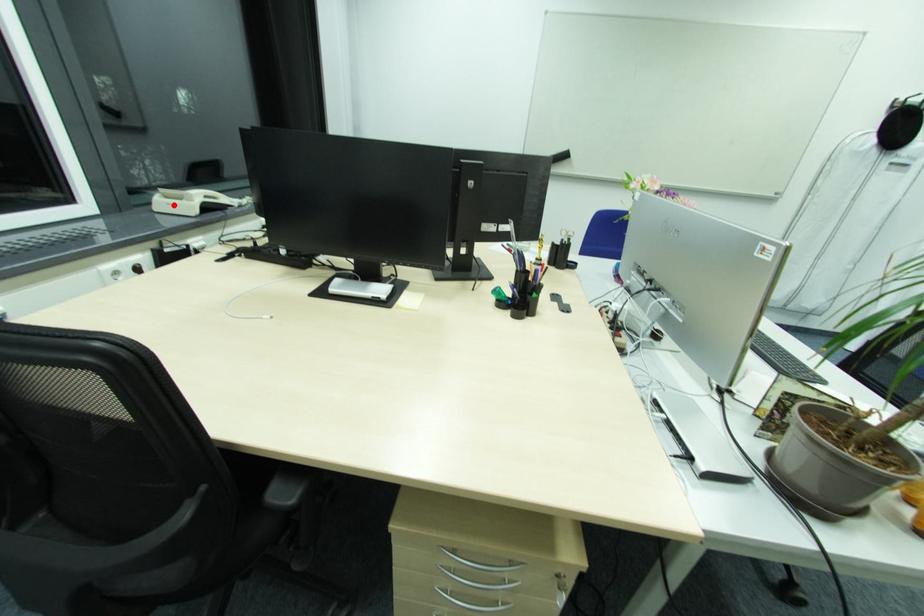
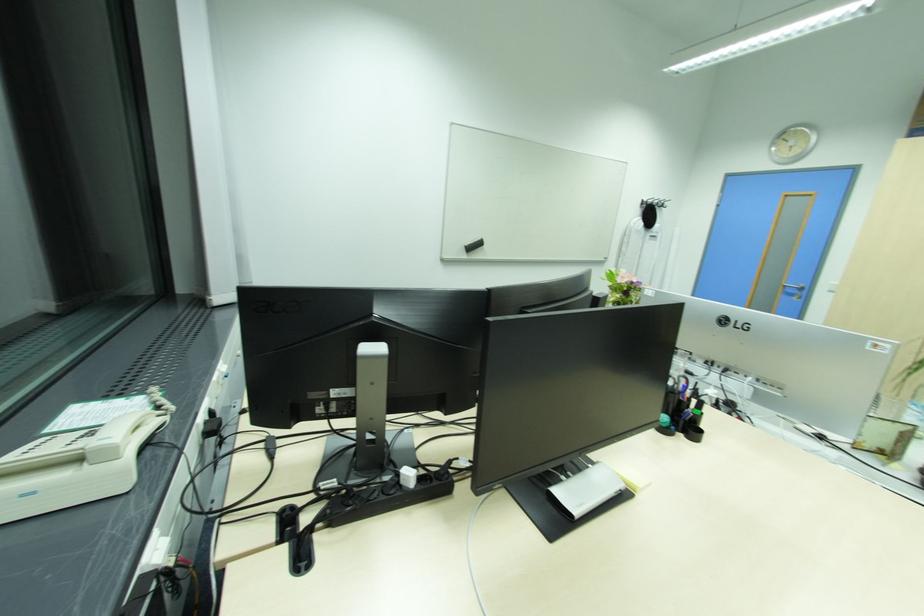
The point at the highlighted location is marked in the first image. Where is the corresponding point in the second image?

(30, 493)